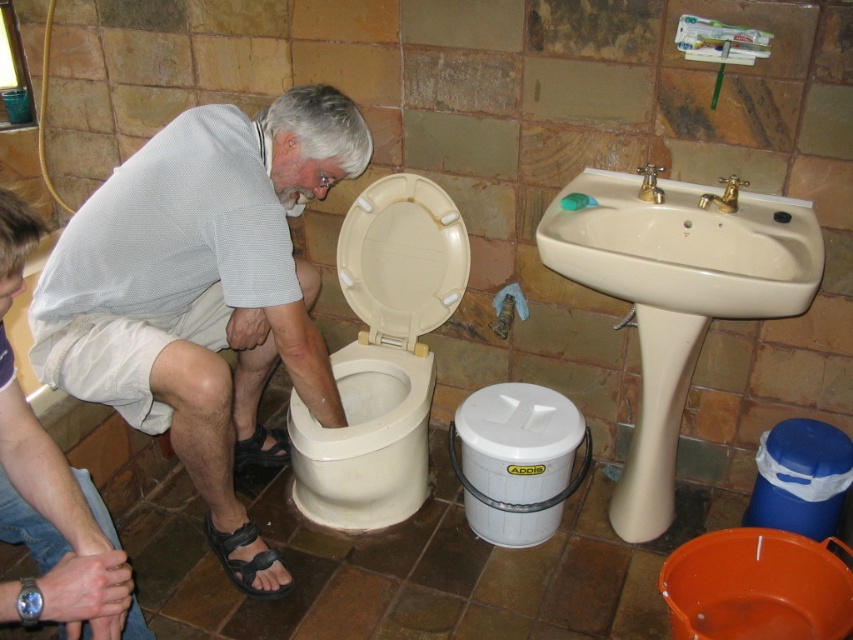
What is the exact coordinate position of the white mesh shirt at center in the image?

The white mesh shirt at center is located at point (201, 282).

You are a home inspector assessing the bathroom. You need to determine which object is larger between the beige ceramic sink at upper right and the beige plastic toilet seat at center. Based on the scene, which one is bigger?

The beige ceramic sink at upper right is bigger than the beige plastic toilet seat at center according to the description.